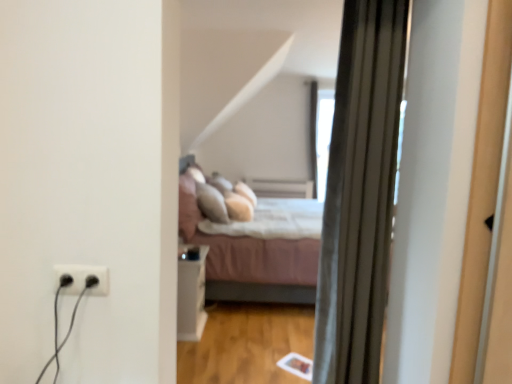
Question: Is pink fabric bed at center touching silky gray curtain at right?

Choices:
 (A) no
 (B) yes

Answer: (A)

Question: Is pink fabric bed at center further to camera compared to silky gray curtain at right?

Choices:
 (A) no
 (B) yes

Answer: (B)

Question: Is pink fabric bed at center positioned in front of silky gray curtain at right?

Choices:
 (A) no
 (B) yes

Answer: (A)

Question: Is silky gray curtain at right surrounded by pink fabric bed at center?

Choices:
 (A) yes
 (B) no

Answer: (B)

Question: From the image's perspective, is pink fabric bed at center under silky gray curtain at right?

Choices:
 (A) yes
 (B) no

Answer: (A)

Question: From the image's perspective, is silky gray curtain at right located above or below white glossy side table at center?

Choices:
 (A) below
 (B) above

Answer: (B)

Question: From a real-world perspective, is silky gray curtain at right positioned above or below white glossy side table at center?

Choices:
 (A) above
 (B) below

Answer: (A)

Question: Based on their positions, is silky gray curtain at right located to the left or right of white glossy side table at center?

Choices:
 (A) left
 (B) right

Answer: (B)

Question: Relative to white glossy side table at center, is silky gray curtain at right in front or behind?

Choices:
 (A) behind
 (B) front

Answer: (B)

Question: In the image, is silky gray curtain at right positioned in front of or behind pink fabric bed at center?

Choices:
 (A) behind
 (B) front

Answer: (B)

Question: Does point (371, 258) appear closer or farther from the camera than point (310, 269)?

Choices:
 (A) closer
 (B) farther

Answer: (A)

Question: From the image's perspective, relative to pink fabric bed at center, is silky gray curtain at right above or below?

Choices:
 (A) above
 (B) below

Answer: (A)

Question: Is silky gray curtain at right wider or thinner than pink fabric bed at center?

Choices:
 (A) thin
 (B) wide

Answer: (A)

Question: Is black plastic outlet at lower left in front of or behind white glossy side table at center in the image?

Choices:
 (A) front
 (B) behind

Answer: (A)

Question: Considering the positions of black plastic outlet at lower left and white glossy side table at center in the image, is black plastic outlet at lower left taller or shorter than white glossy side table at center?

Choices:
 (A) short
 (B) tall

Answer: (A)